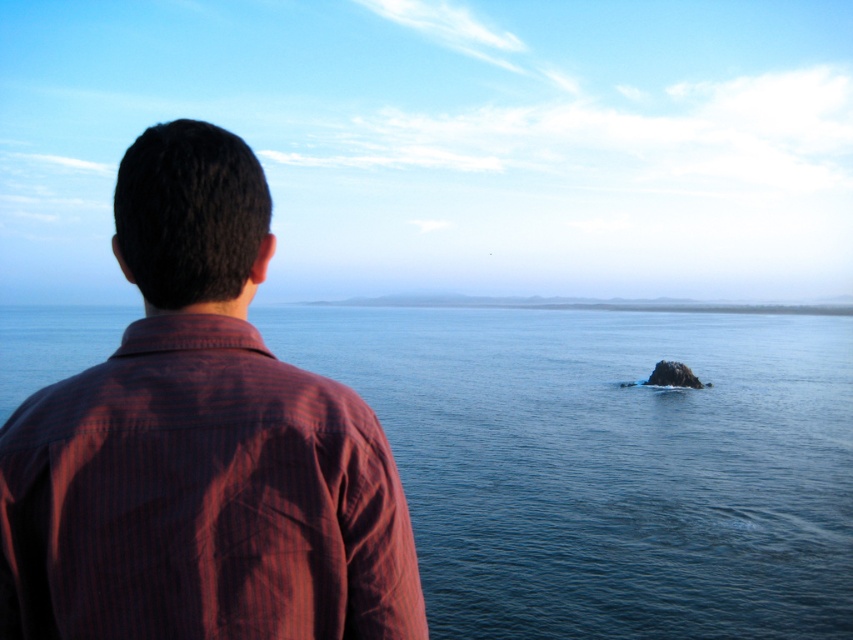
Between blue water at center and striped cotton shirt at upper left, which one appears on the left side from the viewer's perspective?

Positioned to the left is striped cotton shirt at upper left.

Is blue water at center positioned in front of striped cotton shirt at upper left?

No, it is not.

The height and width of the screenshot is (640, 853). What do you see at coordinates (607, 465) in the screenshot?
I see `blue water at center` at bounding box center [607, 465].

Locate an element on the screen. The width and height of the screenshot is (853, 640). blue water at center is located at coordinates (607, 465).